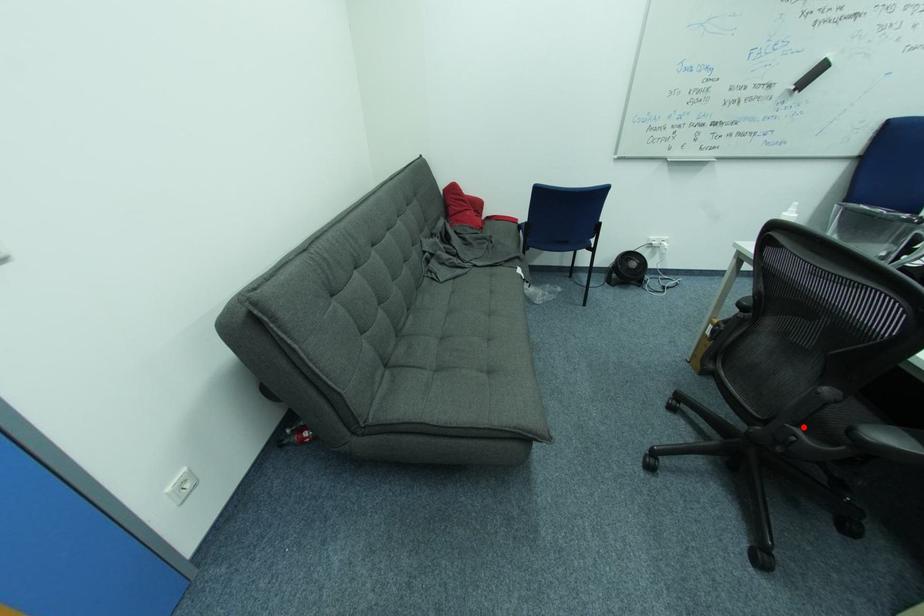
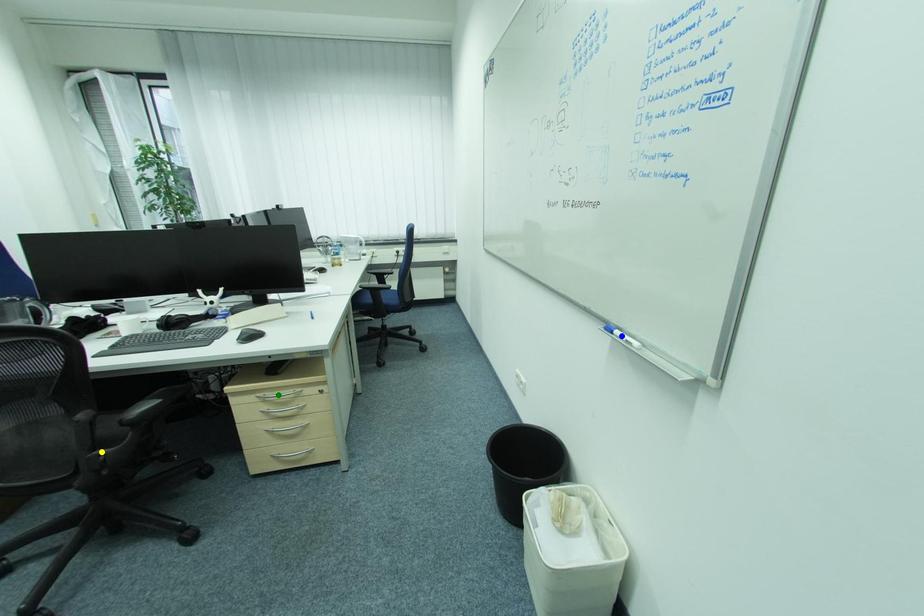
Question: I am providing you with two images of the same scene from different viewpoints. A red point is marked on the first image. You are given multiple points on the second image. In image 2, which mark is for the same physical point as the one in image 1?

Choices:
 (A) green point
 (B) yellow point
 (C) blue point

Answer: (B)